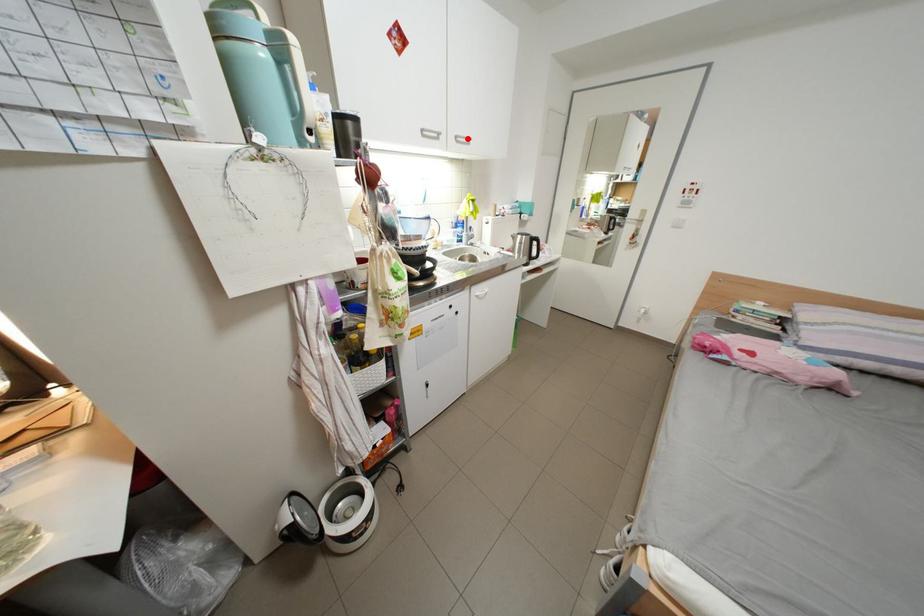
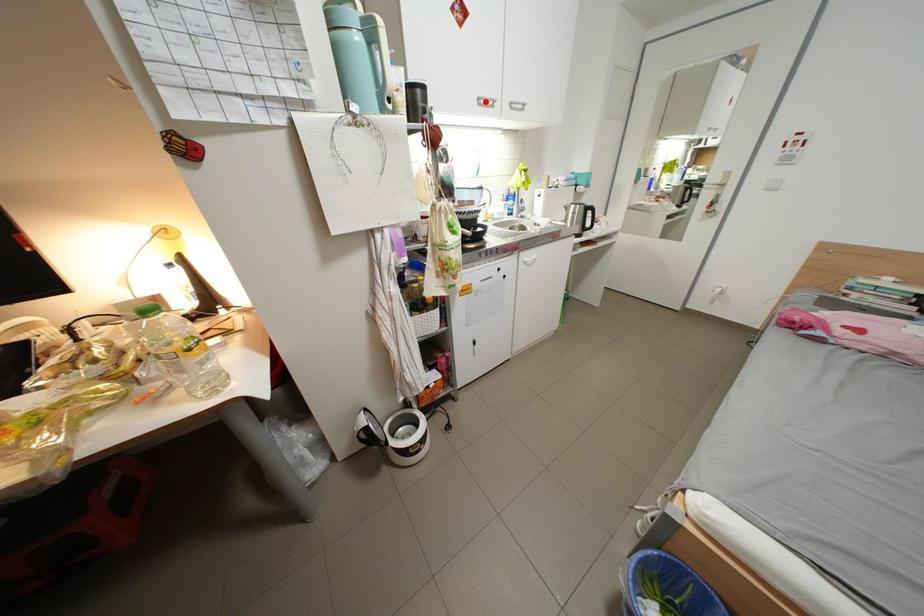
I am providing you with two images of the same scene from different viewpoints. A red point is marked on the first image and another point is marked on the second image. Does the point marked in image1 correspond to the same location as the one in image2?

No